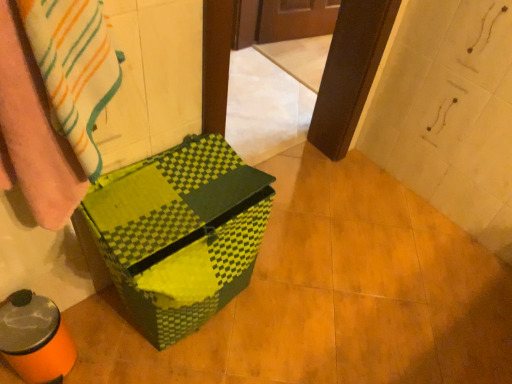
This screenshot has width=512, height=384. What do you see at coordinates (74, 68) in the screenshot? I see `striped cotton towel at left` at bounding box center [74, 68].

The width and height of the screenshot is (512, 384). Find the location of `striped cotton towel at left`. striped cotton towel at left is located at coordinates (74, 68).

Where is `green checkered cardboard box at center`? green checkered cardboard box at center is located at coordinates (180, 233).

What do you see at coordinates (180, 233) in the screenshot? I see `green checkered cardboard box at center` at bounding box center [180, 233].

Identify the location of striped cotton towel at left. (74, 68).

Visually, is striped cotton towel at left positioned to the left or to the right of green checkered cardboard box at center?

Clearly, striped cotton towel at left is on the left of green checkered cardboard box at center in the image.

Is striped cotton towel at left in front of or behind green checkered cardboard box at center in the image?

striped cotton towel at left is positioned closer to the viewer than green checkered cardboard box at center.

Between point (53, 34) and point (140, 211), which one is positioned in front?

The point (53, 34) is more forward.

From the image's perspective, between striped cotton towel at left and green checkered cardboard box at center, which one is located above?

striped cotton towel at left is shown above in the image.

From a real-world perspective, is striped cotton towel at left over green checkered cardboard box at center?

Yes, from a real-world perspective, striped cotton towel at left is on top of green checkered cardboard box at center.

Looking at their sizes, would you say striped cotton towel at left is wider or thinner than green checkered cardboard box at center?

striped cotton towel at left is thinner than green checkered cardboard box at center.

Considering the sizes of striped cotton towel at left and green checkered cardboard box at center in the image, is striped cotton towel at left taller or shorter than green checkered cardboard box at center?

In the image, striped cotton towel at left appears to be shorter than green checkered cardboard box at center.

Between striped cotton towel at left and green checkered cardboard box at center, which one has larger size?

With larger size is green checkered cardboard box at center.

Would you say striped cotton towel at left contains green checkered cardboard box at center?

No, green checkered cardboard box at center is not a part of striped cotton towel at left.

Would you consider striped cotton towel at left to be distant from green checkered cardboard box at center?

No, striped cotton towel at left is not far from green checkered cardboard box at center.

Could you tell me if striped cotton towel at left is turned towards green checkered cardboard box at center?

No.

How different are the orientations of striped cotton towel at left and green checkered cardboard box at center in degrees?

The facing directions of striped cotton towel at left and green checkered cardboard box at center are 0.000133 degrees apart.

The width and height of the screenshot is (512, 384). What are the coordinates of `cardboard box below the striped cotton towel at left (from a real-world perspective)` in the screenshot? It's located at (180, 233).

Visually, is green checkered cardboard box at center positioned to the left or to the right of striped cotton towel at left?

green checkered cardboard box at center is to the right of striped cotton towel at left.

Does green checkered cardboard box at center lie behind striped cotton towel at left?

Yes, green checkered cardboard box at center is further from the viewer.

Which point is more forward, (201, 136) or (94, 11)?

The point (94, 11) is more forward.

From the image's perspective, would you say green checkered cardboard box at center is shown under striped cotton towel at left?

Yes, from the image's perspective, green checkered cardboard box at center is beneath striped cotton towel at left.

From a real-world perspective, is green checkered cardboard box at center on striped cotton towel at left?

No, from a real-world perspective, green checkered cardboard box at center is not above striped cotton towel at left.

Is green checkered cardboard box at center thinner than striped cotton towel at left?

No.

Is green checkered cardboard box at center shorter than striped cotton towel at left?

No.

Is green checkered cardboard box at center smaller than striped cotton towel at left?

Actually, green checkered cardboard box at center might be larger than striped cotton towel at left.

Is green checkered cardboard box at center inside the boundaries of striped cotton towel at left, or outside?

green checkered cardboard box at center is not inside striped cotton towel at left, it's outside.

Based on the photo, is green checkered cardboard box at center directly adjacent to striped cotton towel at left?

green checkered cardboard box at center is not next to striped cotton towel at left, and they're not touching.

Does green checkered cardboard box at center turn towards striped cotton towel at left?

No, green checkered cardboard box at center is not facing towards striped cotton towel at left.

How different are the orientations of green checkered cardboard box at center and striped cotton towel at left in degrees?

The angular difference between green checkered cardboard box at center and striped cotton towel at left is 0.000133 degrees.

Measure the distance between green checkered cardboard box at center and striped cotton towel at left.

green checkered cardboard box at center and striped cotton towel at left are 15.14 inches apart from each other.

Identify the location of blanket that appears in front of the green checkered cardboard box at center. This screenshot has width=512, height=384. (74, 68).

Find the location of a particular element. The width and height of the screenshot is (512, 384). blanket above the green checkered cardboard box at center (from the image's perspective) is located at coordinates (74, 68).

Where is `blanket that is in front of the green checkered cardboard box at center`? This screenshot has height=384, width=512. blanket that is in front of the green checkered cardboard box at center is located at coordinates (74, 68).